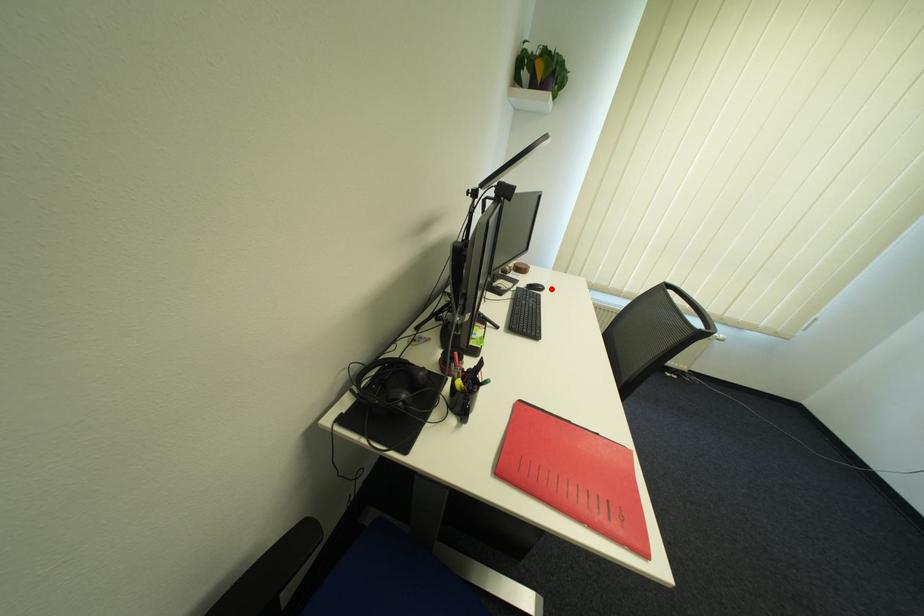
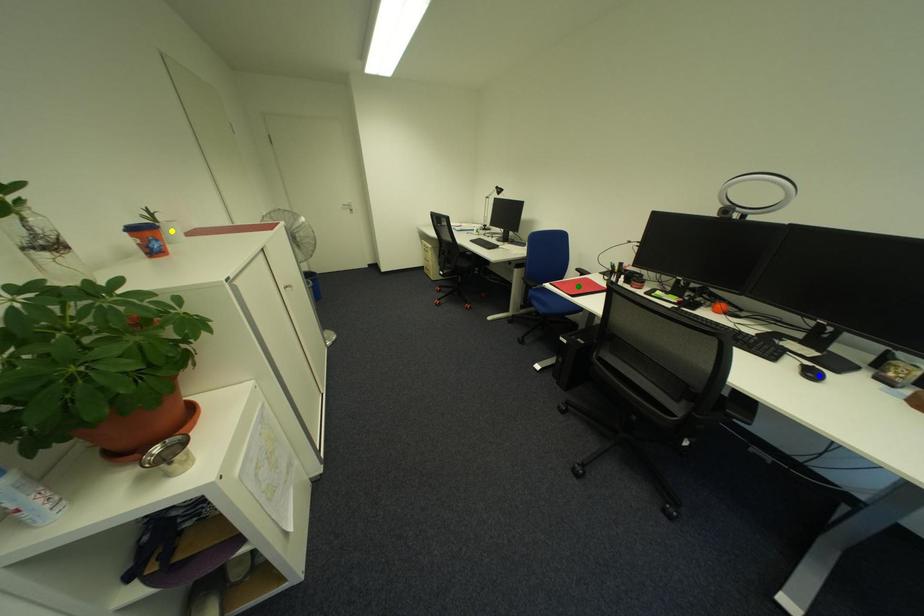
Question: I am providing you with two images of the same scene from different viewpoints. A red point is marked on the first image. You are given multiple points on the second image. Which point in image 2 is actually the same real-world point as the red point in image 1?

Choices:
 (A) green point
 (B) blue point
 (C) yellow point

Answer: (B)